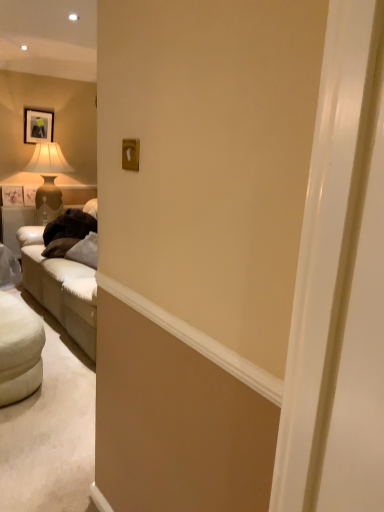
Question: Does white fabric ottoman at lower left have a greater height compared to matte beige lampshade at left?

Choices:
 (A) no
 (B) yes

Answer: (A)

Question: Does white fabric ottoman at lower left have a smaller size compared to matte beige lampshade at left?

Choices:
 (A) yes
 (B) no

Answer: (A)

Question: Considering the relative sizes of white fabric ottoman at lower left and matte beige lampshade at left in the image provided, is white fabric ottoman at lower left bigger than matte beige lampshade at left?

Choices:
 (A) no
 (B) yes

Answer: (A)

Question: Is matte beige lampshade at left a part of white fabric ottoman at lower left?

Choices:
 (A) no
 (B) yes

Answer: (A)

Question: Can you confirm if white fabric ottoman at lower left is positioned to the left of matte beige lampshade at left?

Choices:
 (A) yes
 (B) no

Answer: (B)

Question: Is white fabric ottoman at lower left far away from matte beige lampshade at left?

Choices:
 (A) yes
 (B) no

Answer: (A)

Question: Is white fabric ottoman at lower left positioned with its back to matte black picture frame at upper left?

Choices:
 (A) yes
 (B) no

Answer: (B)

Question: From a real-world perspective, is white fabric ottoman at lower left on top of matte black picture frame at upper left?

Choices:
 (A) yes
 (B) no

Answer: (B)

Question: From the image's perspective, does white fabric ottoman at lower left appear higher than matte black picture frame at upper left?

Choices:
 (A) yes
 (B) no

Answer: (B)

Question: Is white fabric ottoman at lower left shorter than matte black picture frame at upper left?

Choices:
 (A) yes
 (B) no

Answer: (A)

Question: Does white fabric ottoman at lower left have a lesser width compared to matte black picture frame at upper left?

Choices:
 (A) no
 (B) yes

Answer: (A)

Question: Is white fabric ottoman at lower left in front of matte black picture frame at upper left?

Choices:
 (A) no
 (B) yes

Answer: (B)

Question: From the image's perspective, does matte beige lampshade at left appear lower than white fabric ottoman at lower left?

Choices:
 (A) no
 (B) yes

Answer: (A)